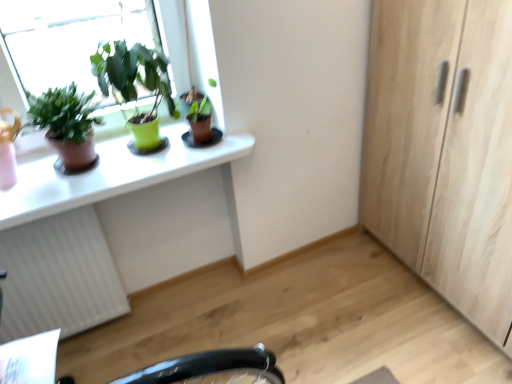
Question: From the image's perspective, is green matte pot at upper left, the second houseplant positioned from the right, over matte brown pot at upper left, arranged as the 3th houseplant when viewed from the right?

Choices:
 (A) no
 (B) yes

Answer: (B)

Question: Is green matte pot at upper left, which is counted as the 2th houseplant, starting from the left, at the right side of matte brown pot at upper left, arranged as the 3th houseplant when viewed from the right?

Choices:
 (A) yes
 (B) no

Answer: (A)

Question: Is green matte pot at upper left, the second houseplant positioned from the right, in front of matte brown pot at upper left, placed as the first houseplant when sorted from left to right?

Choices:
 (A) yes
 (B) no

Answer: (B)

Question: Is green matte pot at upper left, the second houseplant positioned from the right, outside of matte brown pot at upper left, arranged as the 3th houseplant when viewed from the right?

Choices:
 (A) yes
 (B) no

Answer: (A)

Question: Can you confirm if green matte pot at upper left, which is counted as the 2th houseplant, starting from the left, is wider than matte brown pot at upper left, arranged as the 3th houseplant when viewed from the right?

Choices:
 (A) no
 (B) yes

Answer: (A)

Question: From a real-world perspective, is green matte pot at upper left, which is counted as the 2th houseplant, starting from the left, on top of matte brown pot at upper left, placed as the first houseplant when sorted from left to right?

Choices:
 (A) no
 (B) yes

Answer: (B)

Question: Considering the relative sizes of light wood cabinet at right and green matte pot at upper left, the second houseplant positioned from the right, in the image provided, is light wood cabinet at right thinner than green matte pot at upper left, the second houseplant positioned from the right,?

Choices:
 (A) no
 (B) yes

Answer: (A)

Question: Does light wood cabinet at right touch green matte pot at upper left, which is counted as the 2th houseplant, starting from the left?

Choices:
 (A) no
 (B) yes

Answer: (A)

Question: From a real-world perspective, is light wood cabinet at right located beneath green matte pot at upper left, which is counted as the 2th houseplant, starting from the left?

Choices:
 (A) yes
 (B) no

Answer: (A)

Question: Is light wood cabinet at right positioned beyond the bounds of green matte pot at upper left, which is counted as the 2th houseplant, starting from the left?

Choices:
 (A) yes
 (B) no

Answer: (A)

Question: Considering the relative sizes of light wood cabinet at right and green matte pot at upper left, the second houseplant positioned from the right, in the image provided, is light wood cabinet at right wider than green matte pot at upper left, the second houseplant positioned from the right,?

Choices:
 (A) yes
 (B) no

Answer: (A)

Question: From the image's perspective, does light wood cabinet at right appear lower than green matte pot at upper left, the second houseplant positioned from the right?

Choices:
 (A) no
 (B) yes

Answer: (B)

Question: From the image's perspective, is white textured radiator at lower left over white glossy desk at upper left?

Choices:
 (A) yes
 (B) no

Answer: (B)